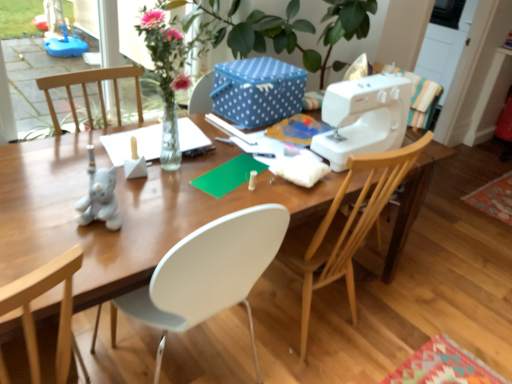
Find the location of a particular element. This screenshot has width=512, height=384. free space in front of blue dotted fabric box at upper center is located at coordinates (239, 131).